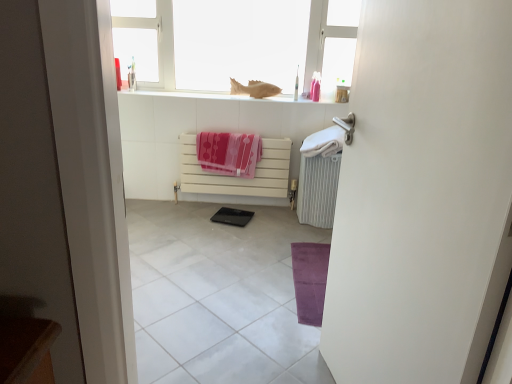
The image size is (512, 384). I want to click on vacant space that is in between white matte radiator at center and purple velvety yoga mat at lower right, so click(x=252, y=237).